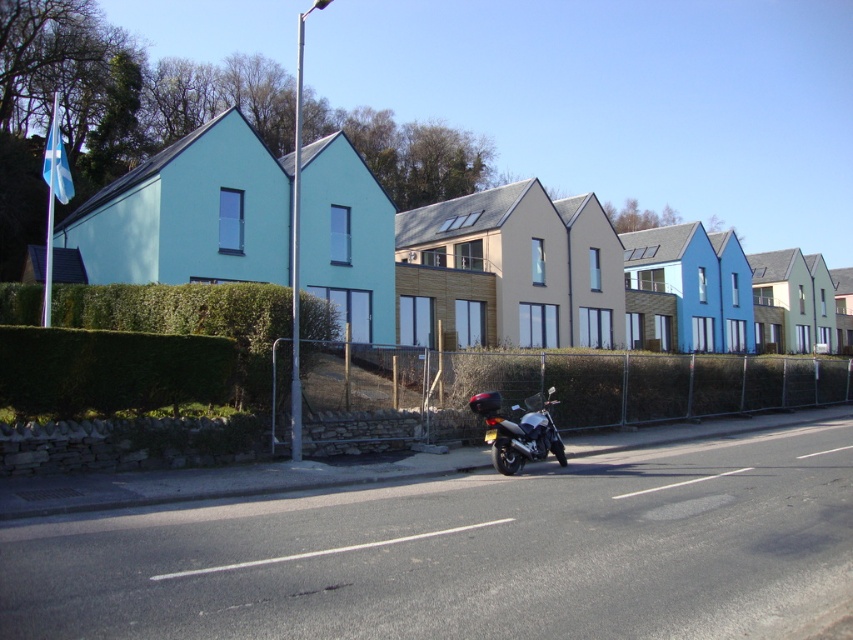
Looking at this image, who is positioned more to the left, silver metallic motorcycle at center or white asphalt road at center?

white asphalt road at center is more to the left.

Image resolution: width=853 pixels, height=640 pixels. Find the location of `silver metallic motorcycle at center`. silver metallic motorcycle at center is located at coordinates (519, 432).

Does green leafy hedge at left appear under white asphalt road at center?

No.

Between green leafy hedge at left and white asphalt road at center, which one is positioned higher?

green leafy hedge at left

Image resolution: width=853 pixels, height=640 pixels. What do you see at coordinates (189, 320) in the screenshot?
I see `green leafy hedge at left` at bounding box center [189, 320].

Locate an element on the screen. This screenshot has width=853, height=640. green leafy hedge at left is located at coordinates (189, 320).

Who is taller, green leafy hedge at left or silver metallic motorcycle at center?

green leafy hedge at left is taller.

Does green leafy hedge at left appear on the right side of silver metallic motorcycle at center?

Incorrect, green leafy hedge at left is not on the right side of silver metallic motorcycle at center.

Image resolution: width=853 pixels, height=640 pixels. I want to click on green leafy hedge at left, so click(189, 320).